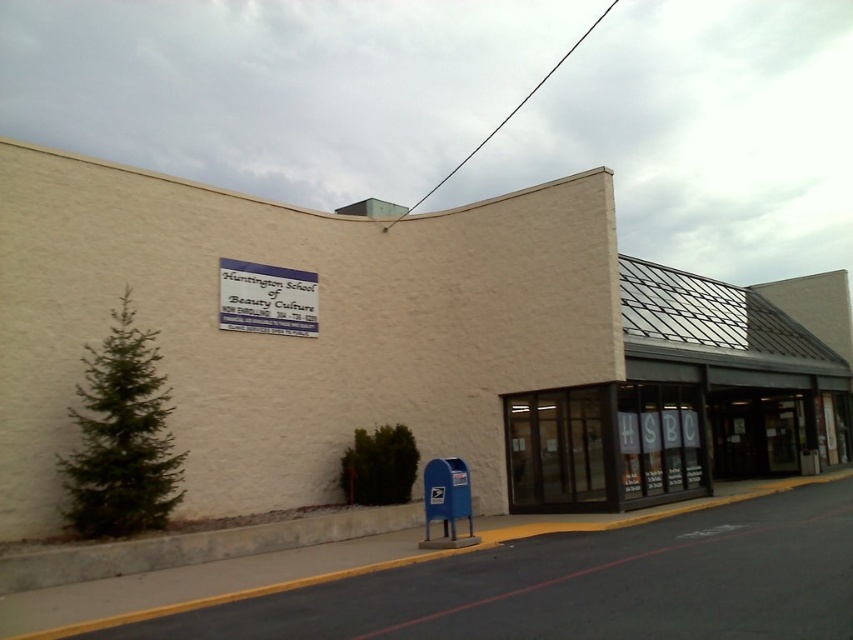
Between clear glass storefront at lower right and blue plastic sign at upper center, which one is positioned higher?

blue plastic sign at upper center is above.

Between point (722, 451) and point (281, 304), which one is positioned behind?

Point (722, 451)

Is point (613, 417) farther from camera compared to point (225, 257)?

Yes, point (613, 417) is farther from viewer.

This screenshot has height=640, width=853. I want to click on clear glass storefront at lower right, so click(x=646, y=442).